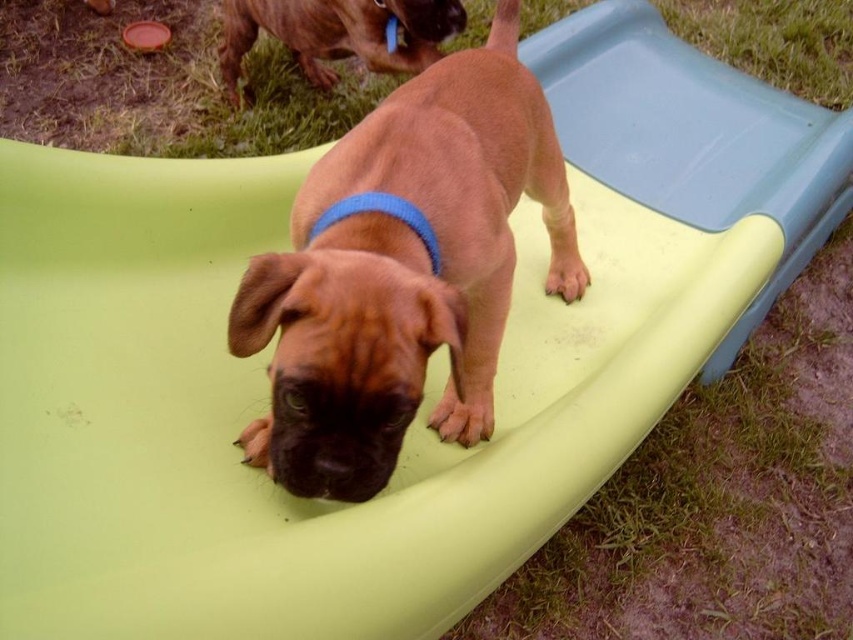
Question: Which point is farther to the camera?

Choices:
 (A) brown matte dog at center
 (B) brown glossy dog at upper center

Answer: (B)

Question: Which point is farther to the camera?

Choices:
 (A) brown matte dog at center
 (B) brown glossy dog at upper center

Answer: (B)

Question: Can you confirm if brown matte dog at center is positioned below brown glossy dog at upper center?

Choices:
 (A) yes
 (B) no

Answer: (A)

Question: From the image, what is the correct spatial relationship of brown matte dog at center in relation to brown glossy dog at upper center?

Choices:
 (A) below
 (B) above

Answer: (A)

Question: Which point is closer to the camera?

Choices:
 (A) (231, 16)
 (B) (335, 188)

Answer: (B)

Question: Is the position of brown matte dog at center less distant than that of brown glossy dog at upper center?

Choices:
 (A) yes
 (B) no

Answer: (A)